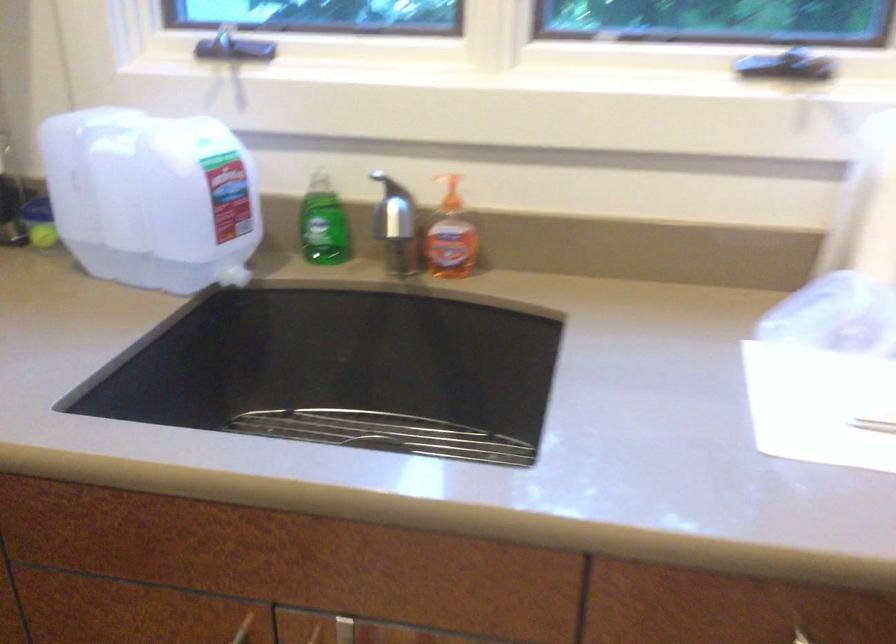
The image size is (896, 644). Identify the location of silver soap pump. (385, 185).